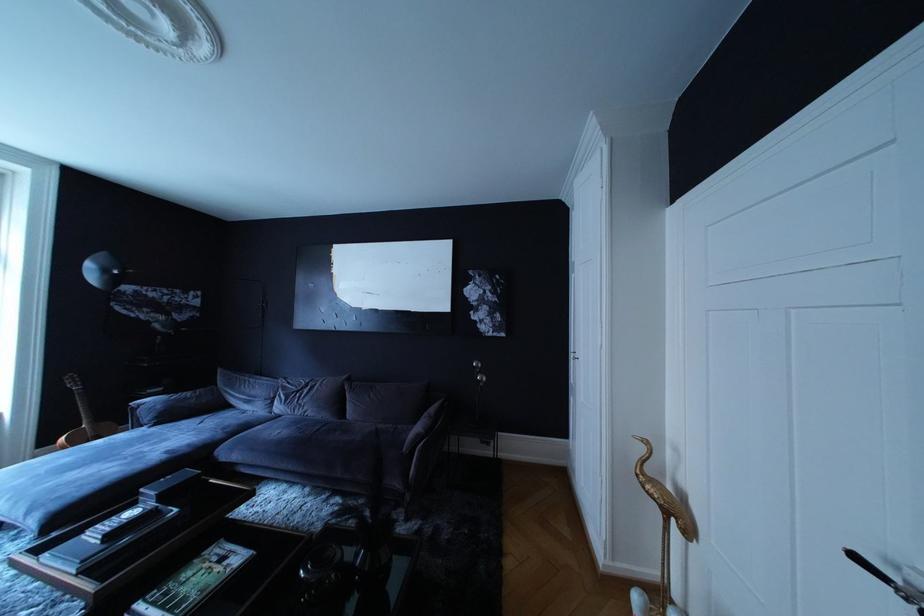
The image size is (924, 616). Describe the element at coordinates (91, 476) in the screenshot. I see `the sofa sitting surface` at that location.